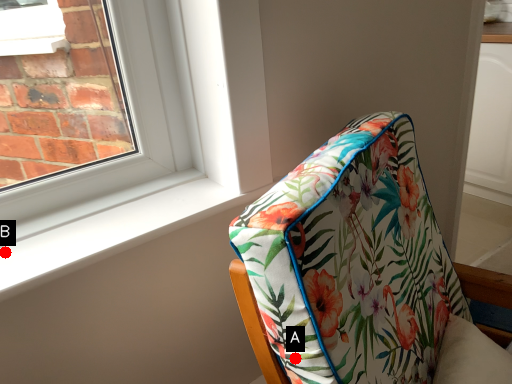
Question: Two points are circled on the image, labeled by A and B beside each circle. Which of the following is the closest to the observer?

Choices:
 (A) A is closer
 (B) B is closer

Answer: (A)